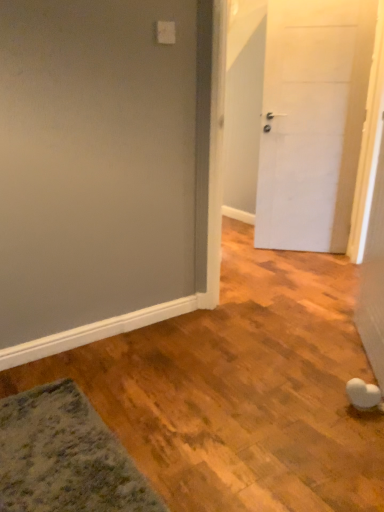
Identify the location of vacant area that lies in front of white matte door at upper right. (308, 264).